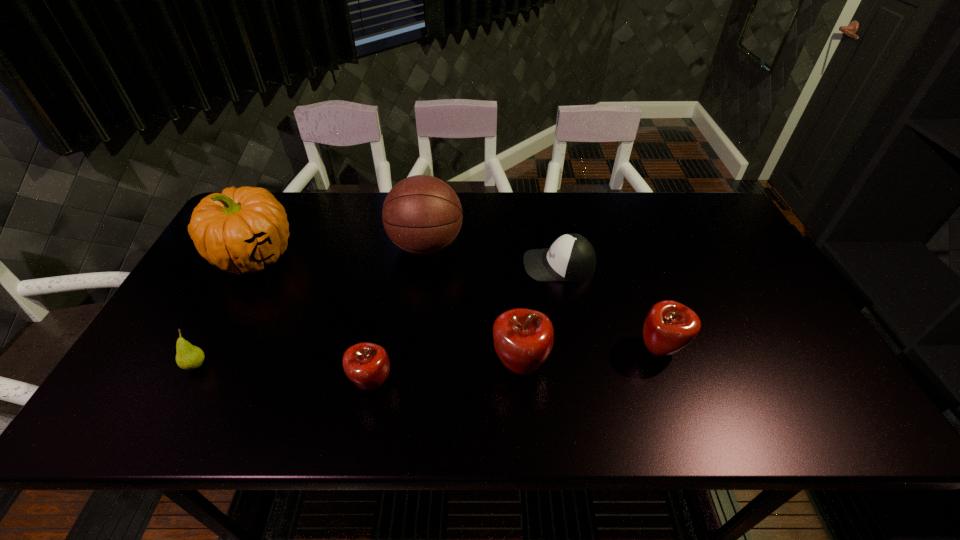
Find the location of a particular element. This screenshot has width=960, height=540. vacant area situated 0.160m on the back of the second tallest apple is located at coordinates (637, 286).

You are a GUI agent. You are given a task and a screenshot of the screen. Output one action in this format:
    pyautogui.click(x=<x>, y=<y>)
    Task: Click on the free spot located 0.190m on the surface of the pumpkin
    The image size is (960, 540).
    Given the screenshot: What is the action you would take?
    pyautogui.click(x=207, y=343)

At what (x,y) coordinates should I click in order to perform the action: click on free space located 0.220m on the front panel of the cap. Please return your answer as a coordinate pair (x, y). This screenshot has height=540, width=960. Looking at the image, I should click on (447, 265).

Image resolution: width=960 pixels, height=540 pixels. In order to click on vacant area situated 0.130m on the front panel of the cap in this screenshot , I will do `click(478, 265)`.

Identify the location of free point located 0.190m on the front panel of the cap. (458, 265).

What are the coordinates of `vacant space located on the front of the basketball` in the screenshot? It's located at (419, 303).

The image size is (960, 540). What are the coordinates of `free region located 0.380m on the back of the pear` in the screenshot? It's located at (258, 251).

Where is `pumpkin present at the far edge`? This screenshot has width=960, height=540. pumpkin present at the far edge is located at coordinates (240, 231).

Image resolution: width=960 pixels, height=540 pixels. Identify the location of basketball at the far edge. (422, 215).

Locate an element on the screen. pear at the near edge is located at coordinates (188, 357).